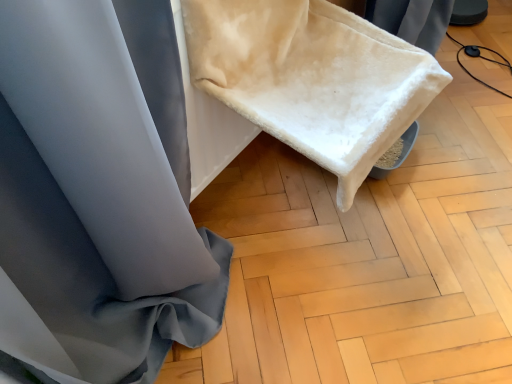
Question: Is white fluffy blanket at upper center behind white soft fabric at lower right?

Choices:
 (A) no
 (B) yes

Answer: (A)

Question: Considering the relative sizes of white fluffy blanket at upper center and white soft fabric at lower right in the image provided, is white fluffy blanket at upper center bigger than white soft fabric at lower right?

Choices:
 (A) yes
 (B) no

Answer: (A)

Question: Is white fluffy blanket at upper center looking in the opposite direction of white soft fabric at lower right?

Choices:
 (A) yes
 (B) no

Answer: (B)

Question: Considering the relative sizes of white fluffy blanket at upper center and white soft fabric at lower right in the image provided, is white fluffy blanket at upper center thinner than white soft fabric at lower right?

Choices:
 (A) yes
 (B) no

Answer: (A)

Question: Is white fluffy blanket at upper center directly adjacent to white soft fabric at lower right?

Choices:
 (A) yes
 (B) no

Answer: (B)

Question: Would you say white soft fabric at lower right is part of white fluffy blanket at upper center's contents?

Choices:
 (A) no
 (B) yes

Answer: (A)

Question: Is white soft fabric at lower right positioned far away from white fluffy blanket at upper center?

Choices:
 (A) yes
 (B) no

Answer: (B)

Question: Can you confirm if white soft fabric at lower right is positioned to the right of white fluffy blanket at upper center?

Choices:
 (A) no
 (B) yes

Answer: (B)

Question: Can you confirm if white soft fabric at lower right is wider than white fluffy blanket at upper center?

Choices:
 (A) no
 (B) yes

Answer: (B)

Question: Could white fluffy blanket at upper center be considered to be inside white soft fabric at lower right?

Choices:
 (A) no
 (B) yes

Answer: (A)

Question: Considering the relative positions of white soft fabric at lower right and white fluffy blanket at upper center in the image provided, is white soft fabric at lower right behind white fluffy blanket at upper center?

Choices:
 (A) yes
 (B) no

Answer: (A)

Question: Considering the relative sizes of white soft fabric at lower right and white fluffy blanket at upper center in the image provided, is white soft fabric at lower right smaller than white fluffy blanket at upper center?

Choices:
 (A) no
 (B) yes

Answer: (B)

Question: From a real-world perspective, is white fluffy blanket at upper center physically located above or below white soft fabric at lower right?

Choices:
 (A) below
 (B) above

Answer: (B)